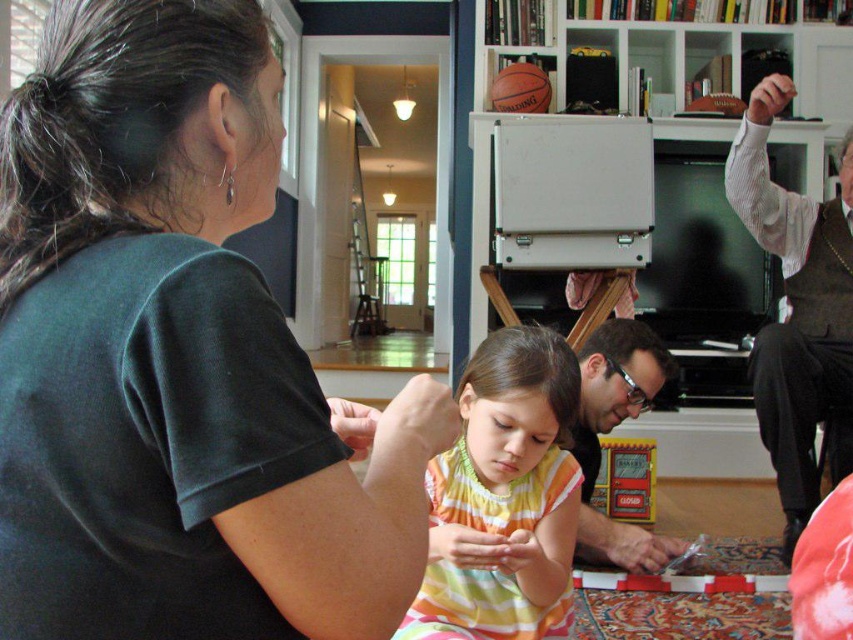
You are standing in the scene and want to touch the point at coordinates (177,358). Which object should you touch to reach that point?

The point at coordinates (177,358) is on the black matte shirt at upper left, so you should touch the black matte shirt at upper left to reach that point.

You are a photographer trying to capture a closeup of the yellow striped dress at center and the matte black book at center. Since you want both objects to appear equally large in the photo, which object should you move closer to the camera?

The yellow striped dress at center is thinner than the matte black book at center, so to make them appear the same size in the photo, move the yellow striped dress at center closer to the camera.